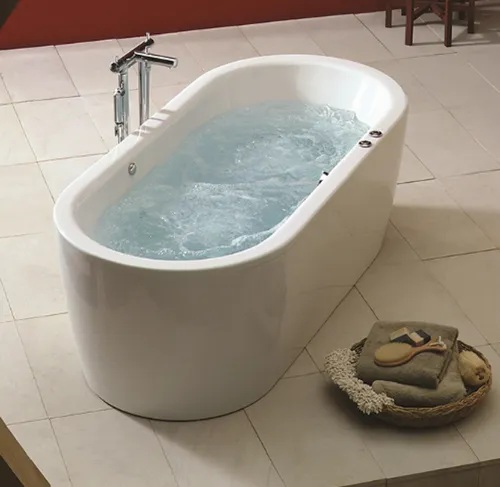
This screenshot has height=487, width=500. I want to click on tiled floor, so click(x=451, y=210).